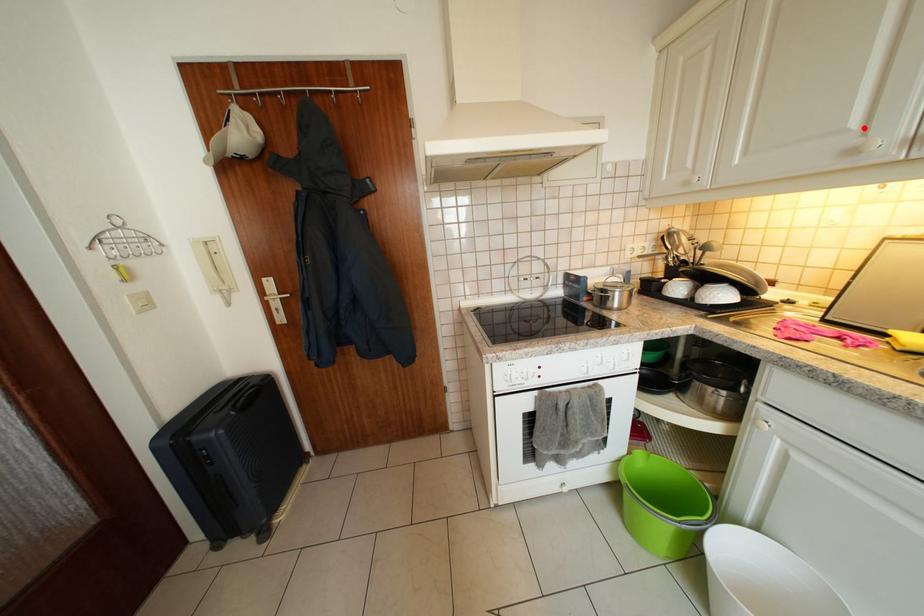
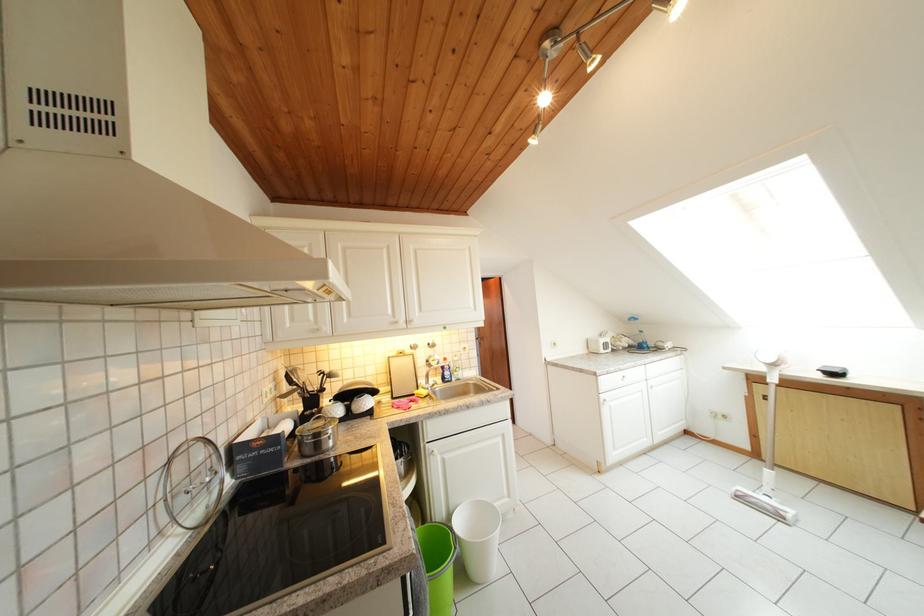
Where in the second image is the point corresponding to the highlighted location from the first image?

(398, 317)